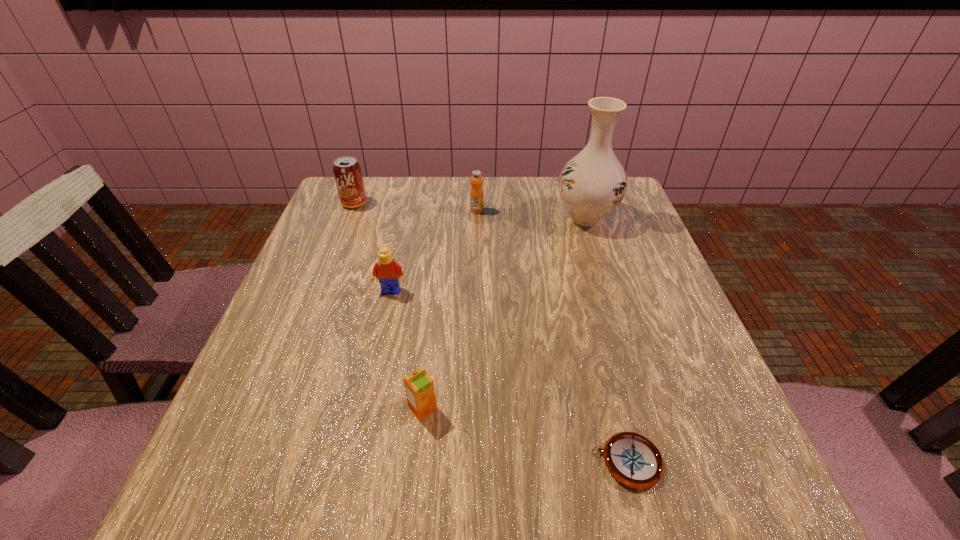
Locate an element on the screen. This screenshot has width=960, height=540. free location at the far left corner is located at coordinates (373, 193).

Identify the location of blank space at the near right corner. This screenshot has width=960, height=540. (756, 473).

The height and width of the screenshot is (540, 960). What are the coordinates of `vacant space that is in between the second nearest object and the second object from left to right` in the screenshot? It's located at (407, 349).

Where is `unoccupied area between the fifth tallest object and the tallest object`? The height and width of the screenshot is (540, 960). unoccupied area between the fifth tallest object and the tallest object is located at coordinates (504, 313).

Where is `vacant area that lies between the compass and the right orange juice`? Image resolution: width=960 pixels, height=540 pixels. vacant area that lies between the compass and the right orange juice is located at coordinates (552, 336).

Locate an element on the screen. The image size is (960, 540). free space between the left orange juice and the Lego is located at coordinates (407, 349).

This screenshot has width=960, height=540. I want to click on vacant region between the nearest object and the vase, so click(607, 339).

At what (x,y) coordinates should I click in order to perform the action: click on empty space that is in between the vase and the second object from left to right. Please return your answer as a coordinate pair (x, y). The image size is (960, 540). Looking at the image, I should click on (489, 254).

Image resolution: width=960 pixels, height=540 pixels. What are the coordinates of `free area in between the Lego and the nearest object` in the screenshot? It's located at (510, 376).

At what (x,y) coordinates should I click in order to perform the action: click on free space between the compass and the tallest object. Please return your answer as a coordinate pair (x, y). The height and width of the screenshot is (540, 960). Looking at the image, I should click on (607, 339).